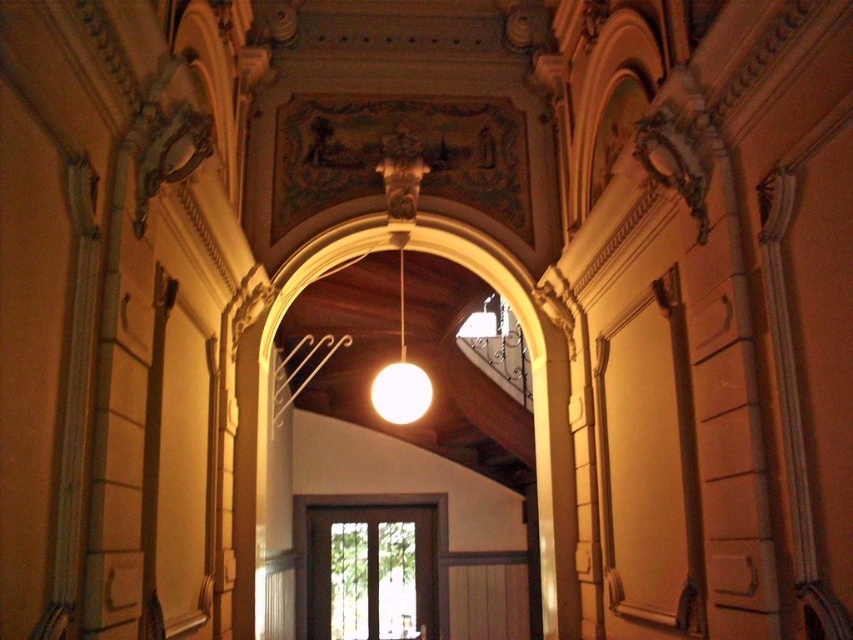
How much distance is there between matte glass door at center and matte white sphere at center?

5.64 meters

Does matte glass door at center appear on the right side of matte white sphere at center?

Incorrect, matte glass door at center is not on the right side of matte white sphere at center.

Does point (305, 612) come farther from viewer compared to point (375, 403)?

Yes, point (305, 612) is behind point (375, 403).

Where is `matte glass door at center`? This screenshot has height=640, width=853. matte glass door at center is located at coordinates (363, 506).